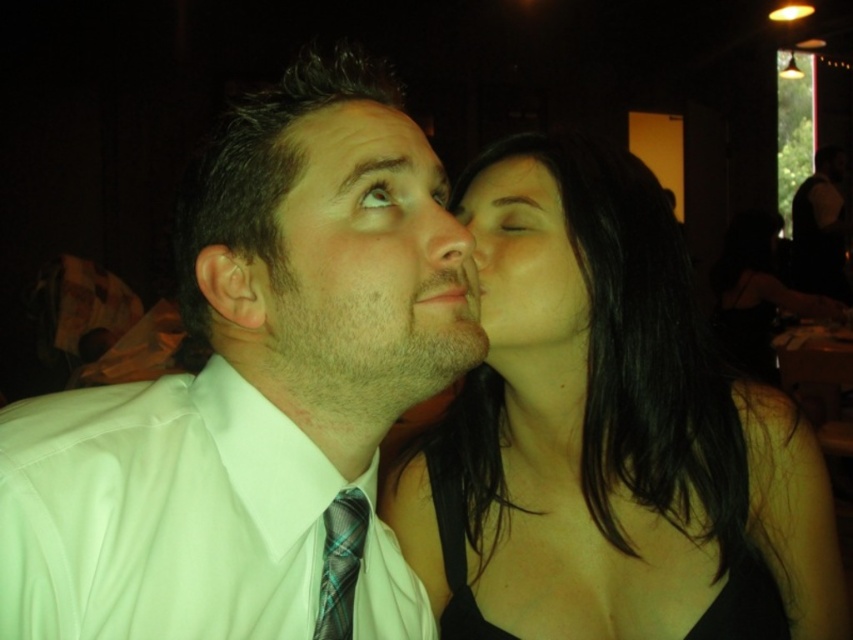
Does white satin shirt at center come behind smooth white shirt at center?

No, it is in front of smooth white shirt at center.

Which is behind, point (73, 589) or point (383, 349)?

Positioned behind is point (383, 349).

Locate an element on the screen. This screenshot has height=640, width=853. white satin shirt at center is located at coordinates (178, 518).

Is black satin dress at center taller than white satin shirt at center?

Yes, black satin dress at center is taller than white satin shirt at center.

Who is positioned more to the left, black satin dress at center or white satin shirt at center?

white satin shirt at center

Is point (741, 404) positioned before point (154, 416)?

No, (741, 404) is further to viewer.

In order to click on black satin dress at center in this screenshot , I will do `click(606, 433)`.

Does white satin shirt at center have a greater height compared to smooth skin face at center?

Indeed, white satin shirt at center has a greater height compared to smooth skin face at center.

Who is more distant from viewer, (216,378) or (479,212)?

Point (479,212)

Find the location of a particular element. The image size is (853, 640). white satin shirt at center is located at coordinates (178, 518).